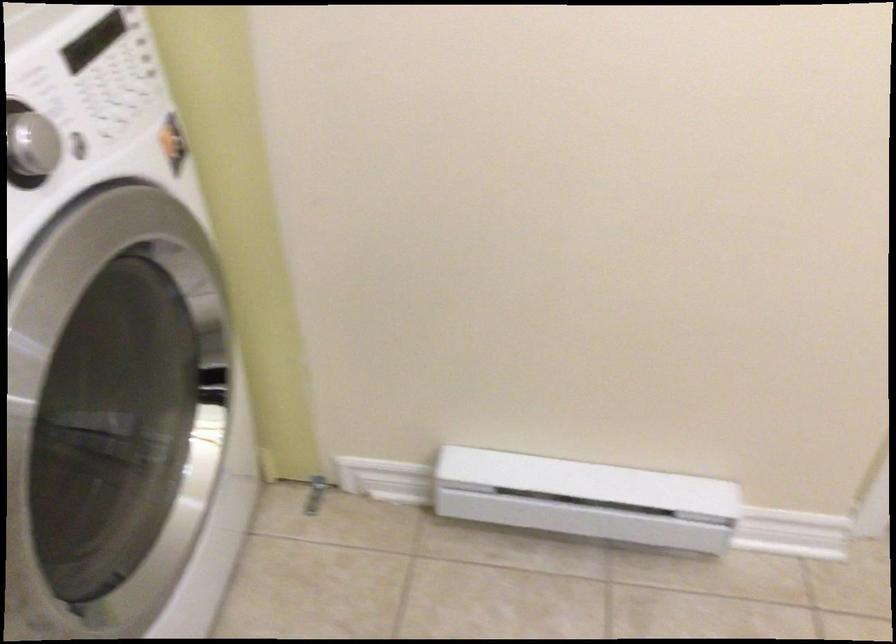
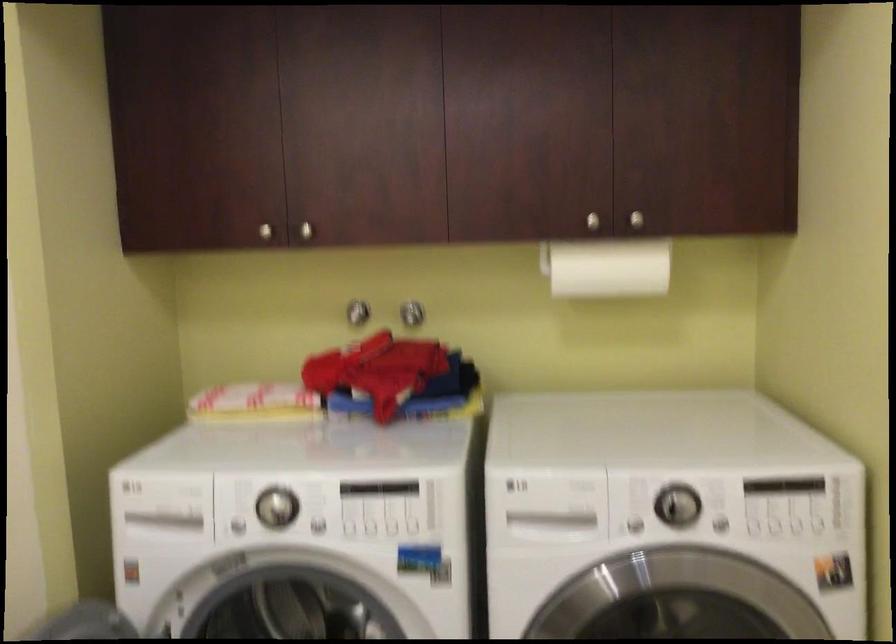
Question: Based on the continuous images, in which direction is the camera rotating? Reply with the corresponding letter.

Choices:
 (A) Left
 (B) Right
 (C) Up
 (D) Down

Answer: (A)